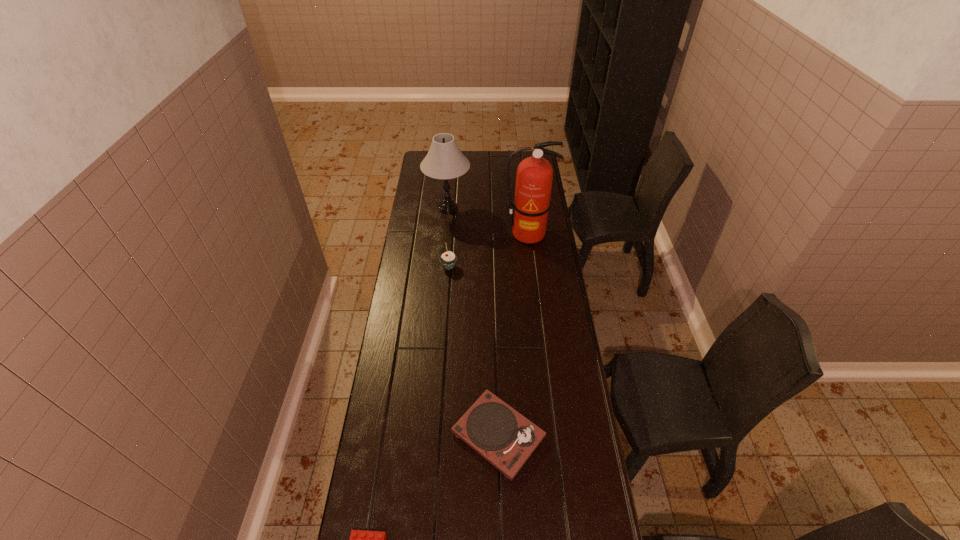
This screenshot has height=540, width=960. I want to click on unoccupied position between the fourth tallest object and the second tallest object, so 473,321.

I want to click on unoccupied area between the farthest object and the third farthest object, so click(x=448, y=238).

Image resolution: width=960 pixels, height=540 pixels. What are the coordinates of `vacant space in between the third shortest object and the lamp` in the screenshot? It's located at (448, 238).

You are a GUI agent. You are given a task and a screenshot of the screen. Output one action in this format:
    pyautogui.click(x=<x>, y=<y>)
    Task: Click on the free spot between the second shortest object and the lamp
    The image size is (960, 540).
    Given the screenshot: What is the action you would take?
    pyautogui.click(x=473, y=321)

Find the location of a particular element. free space between the third nearest object and the tallest object is located at coordinates (489, 251).

Locate an element on the screen. The image size is (960, 540). free area in between the lamp and the third tallest object is located at coordinates (448, 238).

Where is `the third closest object to the lamp`? This screenshot has height=540, width=960. the third closest object to the lamp is located at coordinates (505, 438).

Where is `the closest object to the second shortest object`? The width and height of the screenshot is (960, 540). the closest object to the second shortest object is located at coordinates (359, 539).

Locate an element on the screen. This screenshot has height=540, width=960. free region that satisfies the following two spatial constraints: 1. on the front side of the second nearest object; 2. on the left side of the cupcake is located at coordinates (437, 435).